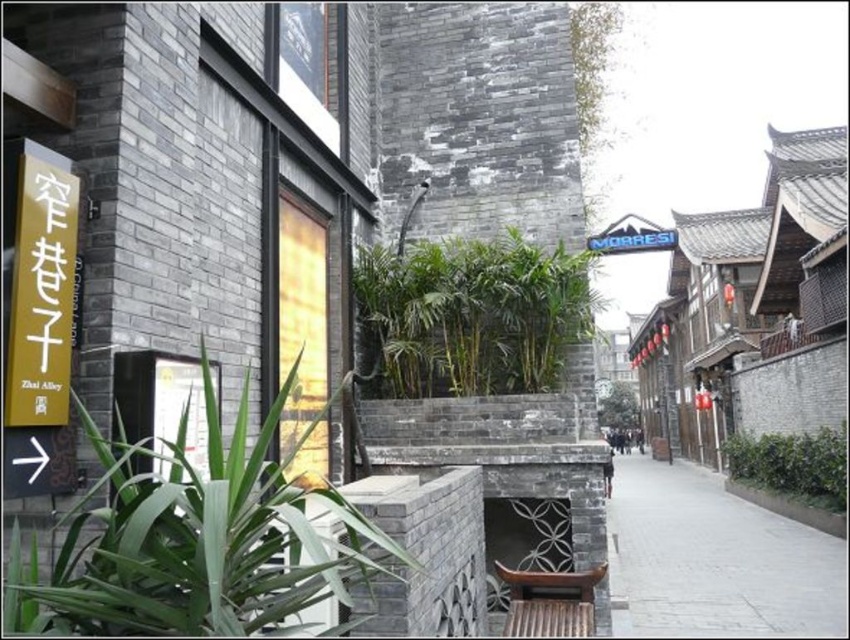
Which is behind, point (726, 512) or point (632, 218)?

Point (726, 512)

Locate an element on the screen. gray concrete pavement at lower right is located at coordinates (714, 560).

Consider the image. Is green leafy bush at lower right to the right of white plastic sign at upper center from the viewer's perspective?

Indeed, green leafy bush at lower right is positioned on the right side of white plastic sign at upper center.

Does green leafy bush at lower right appear under white plastic sign at upper center?

Yes, green leafy bush at lower right is below white plastic sign at upper center.

What do you see at coordinates (792, 464) in the screenshot?
I see `green leafy bush at lower right` at bounding box center [792, 464].

At what (x,y) coordinates should I click in order to perform the action: click on green leafy bush at lower right. Please return your answer as a coordinate pair (x, y). The image size is (850, 640). Looking at the image, I should click on (792, 464).

Between gray concrete pavement at lower right and green leafy plant at center, which one has more height?

gray concrete pavement at lower right is taller.

Can you confirm if gray concrete pavement at lower right is thinner than green leafy plant at center?

No, gray concrete pavement at lower right is not thinner than green leafy plant at center.

What do you see at coordinates (714, 560) in the screenshot? I see `gray concrete pavement at lower right` at bounding box center [714, 560].

The height and width of the screenshot is (640, 850). Find the location of `gray concrete pavement at lower right`. gray concrete pavement at lower right is located at coordinates (714, 560).